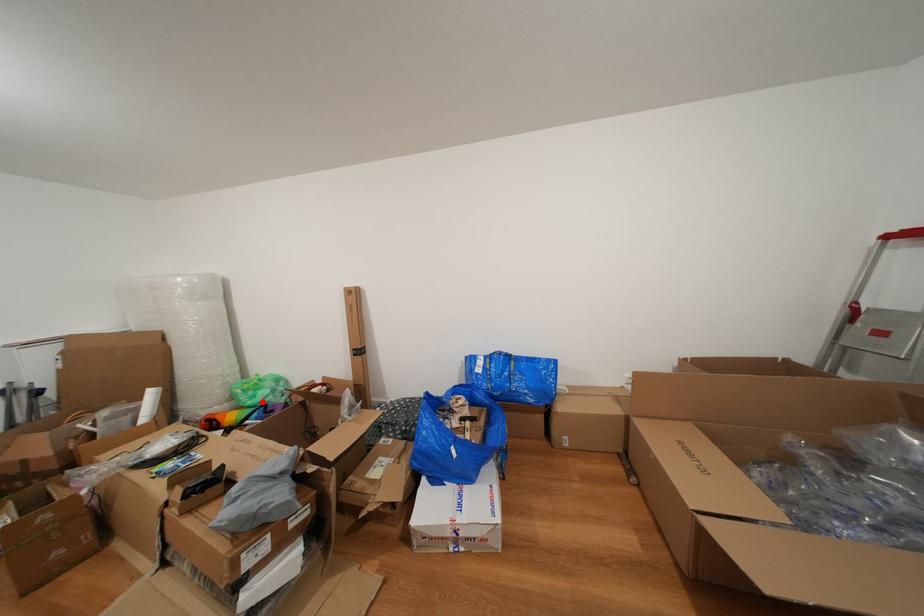
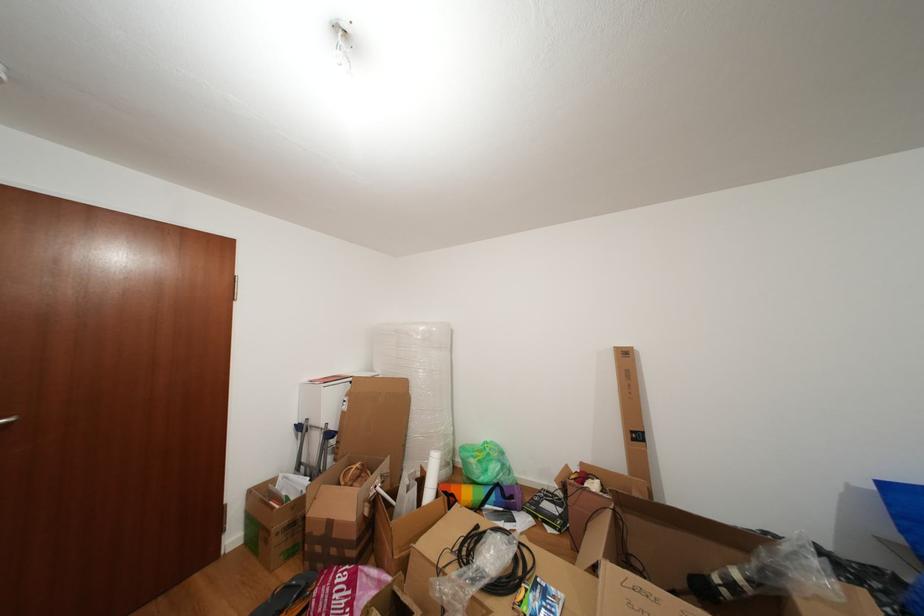
Question: I am providing you with two images of the same scene from different viewpoints. Given a red point in image1, look at the same physical point in image2. Is it:

Choices:
 (A) Closer to the viewpoint
 (B) Farther from the viewpoint

Answer: (B)